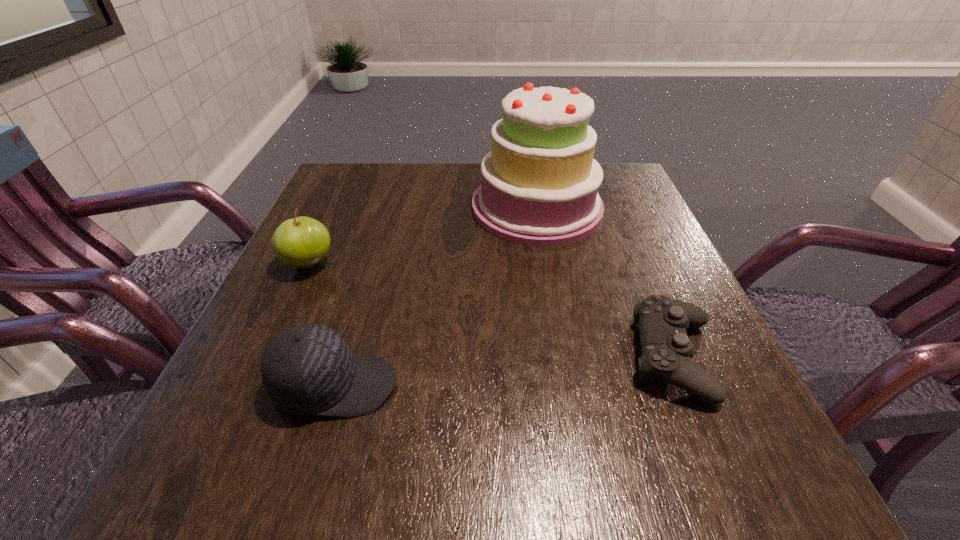
At what (x,y) coordinates should I click in order to perform the action: click on the tallest object. Please return your answer as a coordinate pair (x, y). This screenshot has height=540, width=960. Looking at the image, I should click on (539, 187).

The width and height of the screenshot is (960, 540). I want to click on cake, so click(539, 187).

Locate an element on the screen. This screenshot has width=960, height=540. apple is located at coordinates (302, 242).

The width and height of the screenshot is (960, 540). Find the location of `baseball cap`. baseball cap is located at coordinates (308, 369).

At what (x,y) coordinates should I click in order to perform the action: click on the shortest object. Please return your answer as a coordinate pair (x, y). Image resolution: width=960 pixels, height=540 pixels. Looking at the image, I should click on (667, 351).

Image resolution: width=960 pixels, height=540 pixels. In order to click on vacant space located 0.080m on the front of the cake in this screenshot , I will do `click(548, 272)`.

Identify the location of blank area located 0.090m on the back of the third nearest object. (327, 223).

This screenshot has height=540, width=960. I want to click on vacant space situated 0.360m at the front of the baseball cap where the brim is located, so click(x=638, y=385).

Find the location of `free space located 0.210m on the back of the control`. free space located 0.210m on the back of the control is located at coordinates (626, 244).

Where is `object that is at the far edge`? object that is at the far edge is located at coordinates (539, 187).